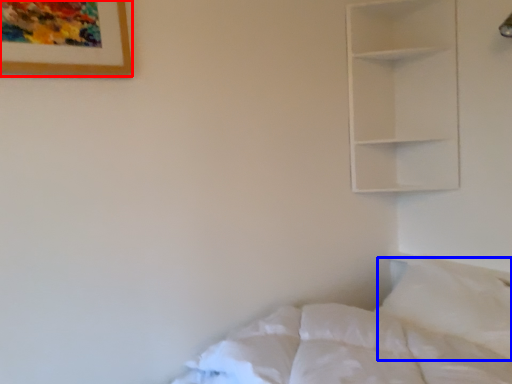
Question: Which point is further to the camera, picture frame (highlighted by a red box) or pillow (highlighted by a blue box)?

Choices:
 (A) picture frame
 (B) pillow

Answer: (B)